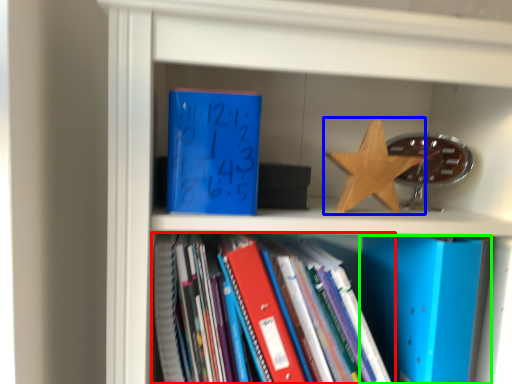
Question: Which object is the closest to the book (highlighted by a red box)? Choose among these: star (highlighted by a blue box) or paperback book (highlighted by a green box).

Choices:
 (A) star
 (B) paperback book

Answer: (B)